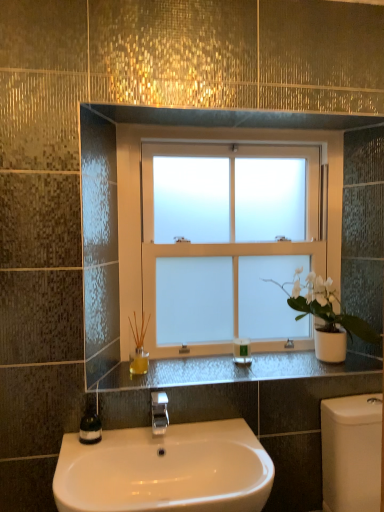
Question: Is green glass soap dispenser at lower left inside white glossy sink at lower center?

Choices:
 (A) no
 (B) yes

Answer: (A)

Question: From the image's perspective, is white glossy sink at lower center located above green glass soap dispenser at lower left?

Choices:
 (A) no
 (B) yes

Answer: (A)

Question: Does white glossy sink at lower center come in front of green glass soap dispenser at lower left?

Choices:
 (A) no
 (B) yes

Answer: (B)

Question: Considering the relative sizes of white glossy sink at lower center and green glass soap dispenser at lower left in the image provided, is white glossy sink at lower center smaller than green glass soap dispenser at lower left?

Choices:
 (A) yes
 (B) no

Answer: (B)

Question: Can you confirm if white glossy sink at lower center is wider than green glass soap dispenser at lower left?

Choices:
 (A) no
 (B) yes

Answer: (B)

Question: From a real-world perspective, is white glossy sink at lower center positioned above or below green glass soap dispenser at lower left?

Choices:
 (A) above
 (B) below

Answer: (B)

Question: Is white glossy sink at lower center taller or shorter than green glass soap dispenser at lower left?

Choices:
 (A) short
 (B) tall

Answer: (B)

Question: Considering the positions of white glossy sink at lower center and green glass soap dispenser at lower left in the image, is white glossy sink at lower center wider or thinner than green glass soap dispenser at lower left?

Choices:
 (A) wide
 (B) thin

Answer: (A)

Question: Looking at the image, does white glossy sink at lower center seem bigger or smaller compared to green glass soap dispenser at lower left?

Choices:
 (A) small
 (B) big

Answer: (B)

Question: In the image, is green plastic bottle at center positioned in front of or behind silver metallic faucet at center?

Choices:
 (A) front
 (B) behind

Answer: (B)

Question: Based on their sizes in the image, would you say green plastic bottle at center is bigger or smaller than silver metallic faucet at center?

Choices:
 (A) big
 (B) small

Answer: (B)

Question: From the image's perspective, is green plastic bottle at center positioned above or below silver metallic faucet at center?

Choices:
 (A) below
 (B) above

Answer: (B)

Question: Choose the correct answer: Is green plastic bottle at center inside silver metallic faucet at center or outside it?

Choices:
 (A) outside
 (B) inside

Answer: (A)

Question: Is silver metallic faucet at center in front of or behind green glass soap dispenser at lower left in the image?

Choices:
 (A) front
 (B) behind

Answer: (A)

Question: Considering the positions of silver metallic faucet at center and green glass soap dispenser at lower left in the image, is silver metallic faucet at center wider or thinner than green glass soap dispenser at lower left?

Choices:
 (A) thin
 (B) wide

Answer: (B)